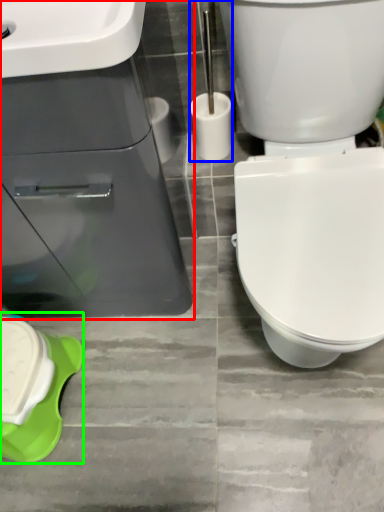
Question: Considering the real-world distances, which object is farthest from sink (highlighted by a red box)? brush (highlighted by a blue box) or porcelain (highlighted by a green box)?

Choices:
 (A) brush
 (B) porcelain

Answer: (A)